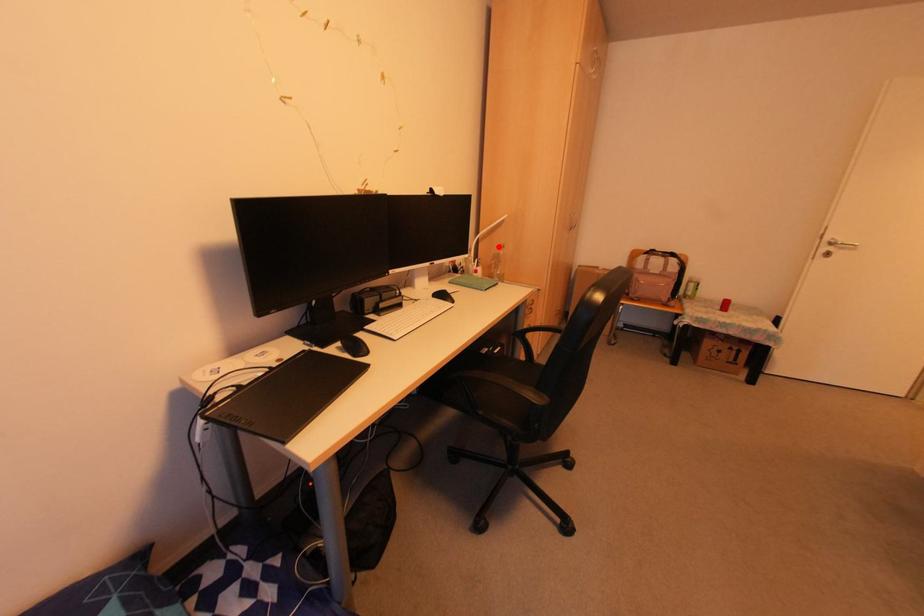
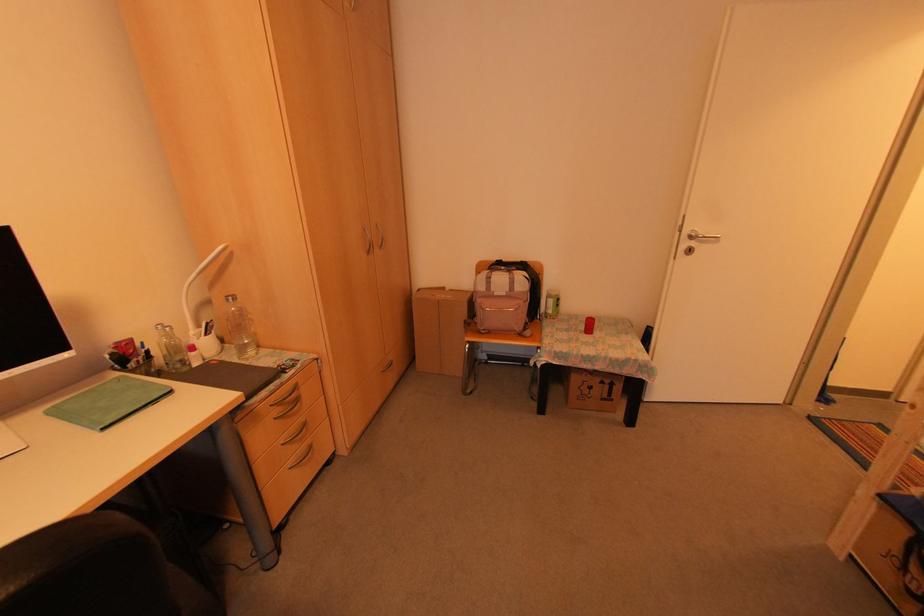
Question: I am providing you with two images of the same scene from different viewpoints. Image1 has a red point marked. In image2, the corresponding 3D location appears at what relative position? Reply with the corresponding letter.

Choices:
 (A) Closer
 (B) Farther

Answer: (B)